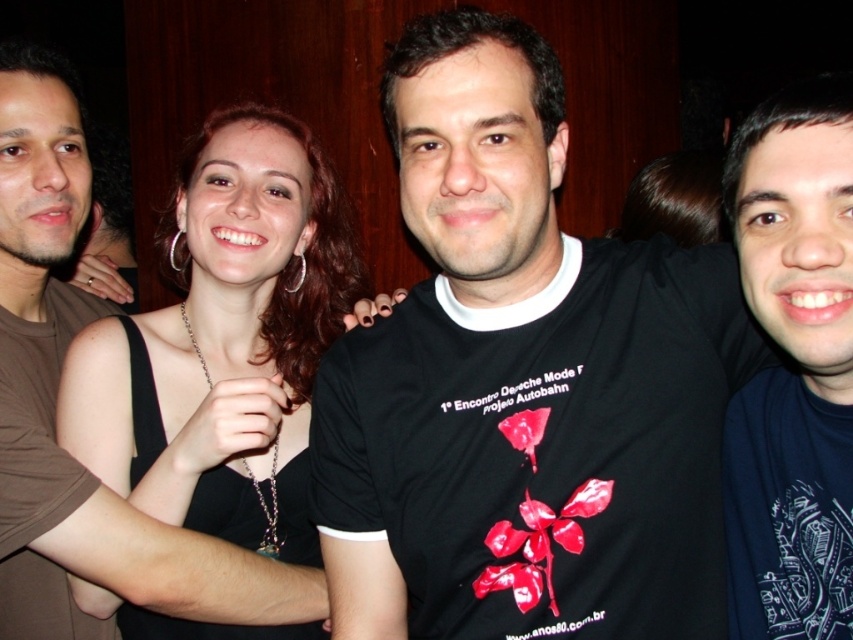
Question: Which is nearer to the black fabric dress at center?

Choices:
 (A) dark blue t-shirt at center
 (B) black t-shirt at center

Answer: (B)

Question: Observing the image, what is the correct spatial positioning of black t-shirt at center in reference to black fabric dress at center?

Choices:
 (A) above
 (B) below

Answer: (A)

Question: Can you confirm if black t-shirt at center is bigger than black fabric dress at center?

Choices:
 (A) no
 (B) yes

Answer: (A)

Question: Which point is closer to the camera taking this photo?

Choices:
 (A) (248, 141)
 (B) (840, 304)
 (C) (425, 161)

Answer: (B)

Question: Is black t-shirt at center closer to camera compared to black fabric dress at center?

Choices:
 (A) no
 (B) yes

Answer: (B)

Question: Which point appears closest to the camera in this image?

Choices:
 (A) (770, 214)
 (B) (277, 124)

Answer: (A)